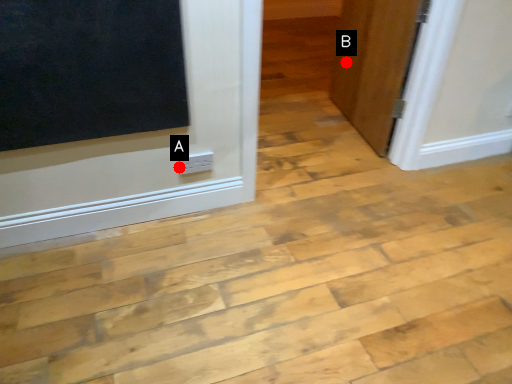
Question: Two points are circled on the image, labeled by A and B beside each circle. Among these points, which one is nearest to the camera?

Choices:
 (A) A is closer
 (B) B is closer

Answer: (A)